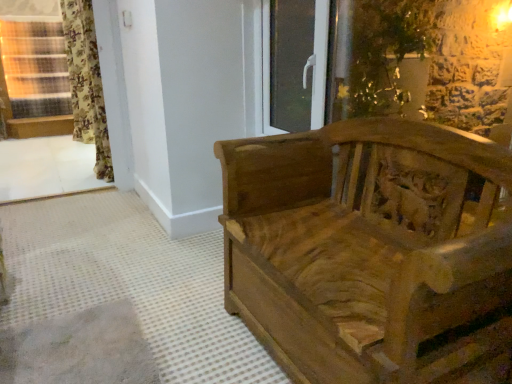
At what (x,y) coordinates should I click in order to perform the action: click on free spot to the right of wooden window frame at lower left. Please return your answer as a coordinate pair (x, y). The width and height of the screenshot is (512, 384). Looking at the image, I should click on (91, 225).